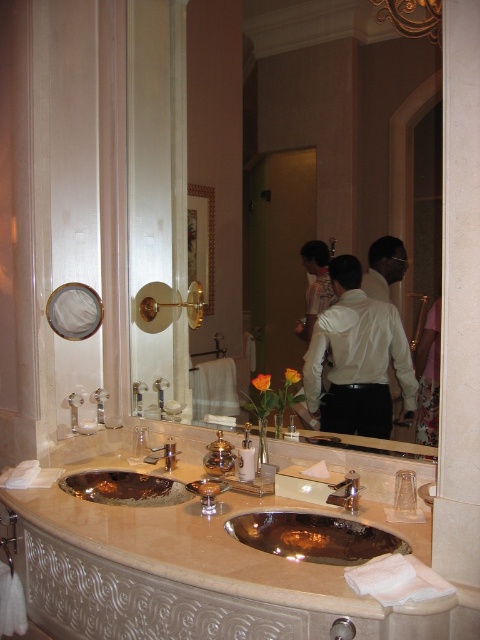
Consider the image. You are designing a layout for a bathroom magazine spread. The editor wants to highlight the beige marble countertop at center and the white satin shirt at center. Since space is limited, you need to decide which object should be featured more prominently. Based on their sizes in the image, which one should take up more space in the layout?

The beige marble countertop at center is bigger than the white satin shirt at center, so it should take up more space in the layout to accurately reflect their sizes in the image.

You are a hotel guest who wants to adjust the water temperature at the sink. You notice the metallic polished sink at center and the brushed metal faucet at sink left. Which object should you interact with to control the water flow?

The brushed metal faucet at sink left controls the water flow since faucets are typically used to adjust water flow and the sink itself is a basin. The metallic polished sink at center is the basin where water flows into, so you should interact with the brushed metal faucet at sink left to control the water flow.

You are standing in the bathroom and want to place a small decorative item on the closest surface to you. Which object between the beige marble countertop at center and the white satin shirt at center should you choose?

The beige marble countertop at center is closer to the viewer than the white satin shirt at center, so you should place the decorative item on the beige marble countertop at center.